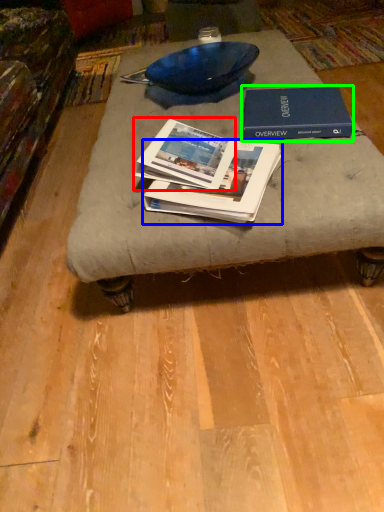
Question: Estimate the real-world distances between objects in this image. Which object is closer to book (highlighted by a red box), book (highlighted by a blue box) or book (highlighted by a green box)?

Choices:
 (A) book
 (B) book

Answer: (A)